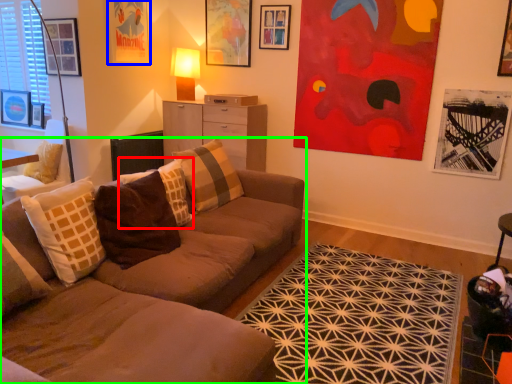
Question: Which is farther away from pillow (highlighted by a red box)? picture frame (highlighted by a blue box) or studio couch (highlighted by a green box)?

Choices:
 (A) picture frame
 (B) studio couch

Answer: (A)